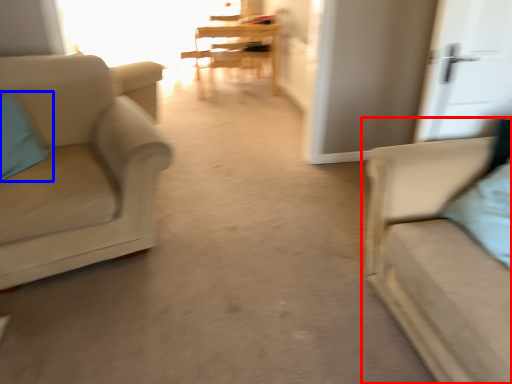
Question: Which object appears farthest to the camera in this image, studio couch (highlighted by a red box) or pillow (highlighted by a blue box)?

Choices:
 (A) studio couch
 (B) pillow

Answer: (B)